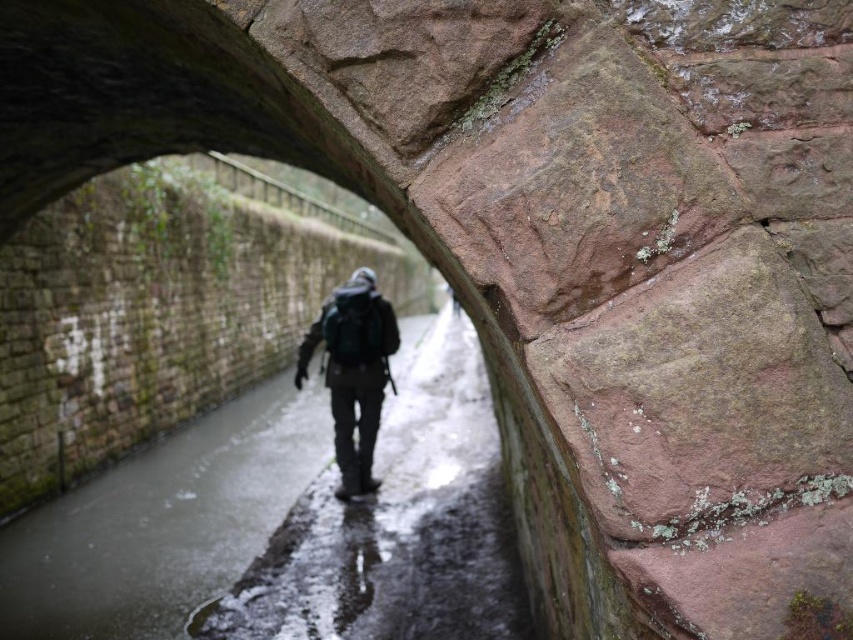
Who is more distant from viewer, (292, 572) or (352, 323)?

Positioned behind is point (352, 323).

Is wet concrete path at center positioned behind dark green backpack at center?

No, it is not.

Which is behind, point (461, 589) or point (332, 292)?

Point (332, 292)

Locate an element on the screen. The height and width of the screenshot is (640, 853). wet concrete path at center is located at coordinates (397, 525).